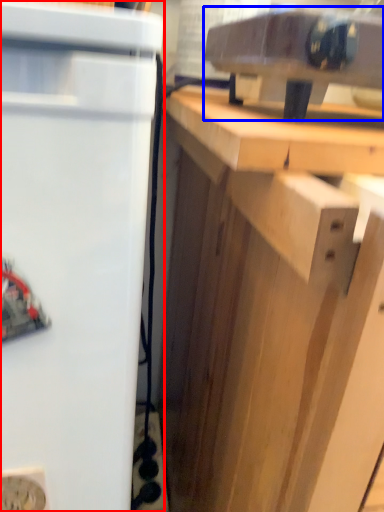
Question: Which object is further to the camera taking this photo, refrigerator (highlighted by a red box) or appliance (highlighted by a blue box)?

Choices:
 (A) refrigerator
 (B) appliance

Answer: (B)